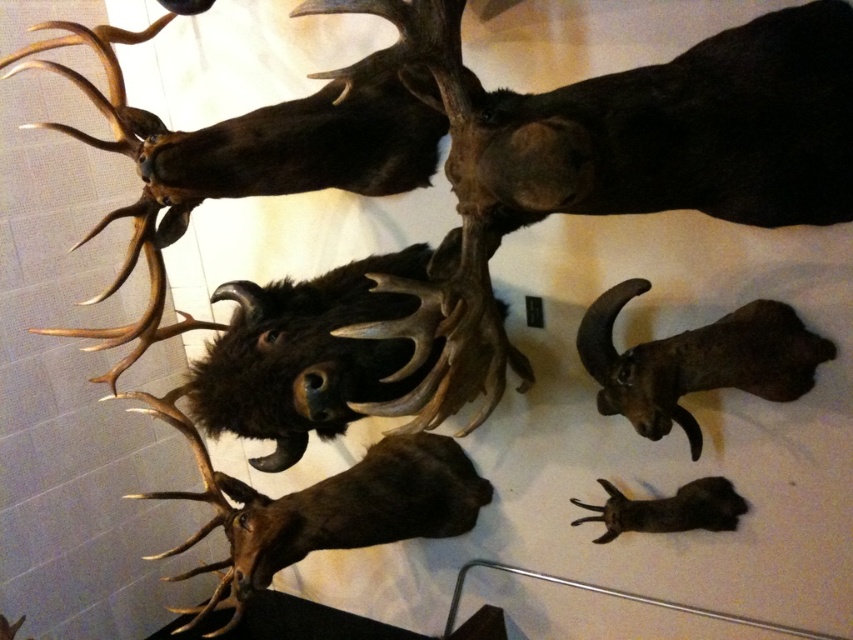
Is brown matte skull at lower right to the left of brown furry rabbit at lower right from the viewer's perspective?

Incorrect, brown matte skull at lower right is not on the left side of brown furry rabbit at lower right.

Between point (659, 362) and point (714, 515), which one is positioned behind?

The point (714, 515) is behind.

In the scene shown: Measure the distance between brown matte skull at lower right and camera.

brown matte skull at lower right is 4.88 feet away from camera.

Find the location of `brown matte skull at lower right`. brown matte skull at lower right is located at coordinates (695, 362).

Which is in front, point (283, 342) or point (602, 392)?

Positioned in front is point (602, 392).

Who is more distant from viewer, [231,394] or [703,330]?

The point [231,394] is behind.

Locate an element on the screen. The height and width of the screenshot is (640, 853). brown furry animal at center is located at coordinates (305, 355).

Is point (451, 493) behind point (602, 408)?

That is True.

Between brown matte/dead deer at center and brown matte skull at lower right, which one is positioned higher?

brown matte skull at lower right is higher up.

This screenshot has width=853, height=640. I want to click on brown matte/dead deer at center, so (323, 506).

Find the location of a particular element. The image size is (853, 640). brown matte/dead deer at center is located at coordinates (323, 506).